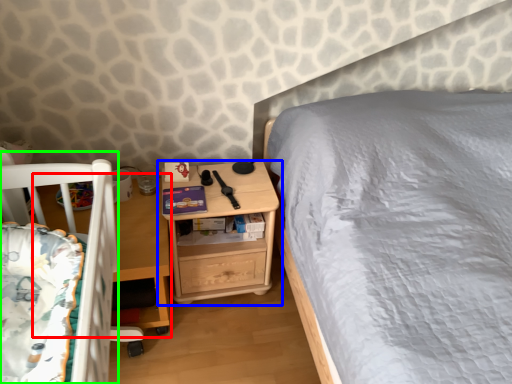
Question: Considering the real-world distances, which object is closest to table (highlighted by a red box)? nightstand (highlighted by a blue box) or infant bed (highlighted by a green box).

Choices:
 (A) nightstand
 (B) infant bed

Answer: (A)